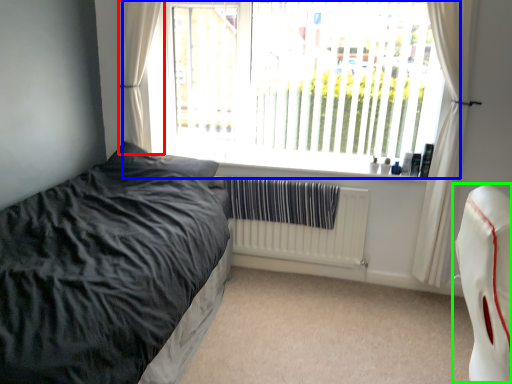
Question: Which object is the closest to the curtain (highlighted by a red box)? Choose among these: window (highlighted by a blue box) or swivel chair (highlighted by a green box).

Choices:
 (A) window
 (B) swivel chair

Answer: (A)